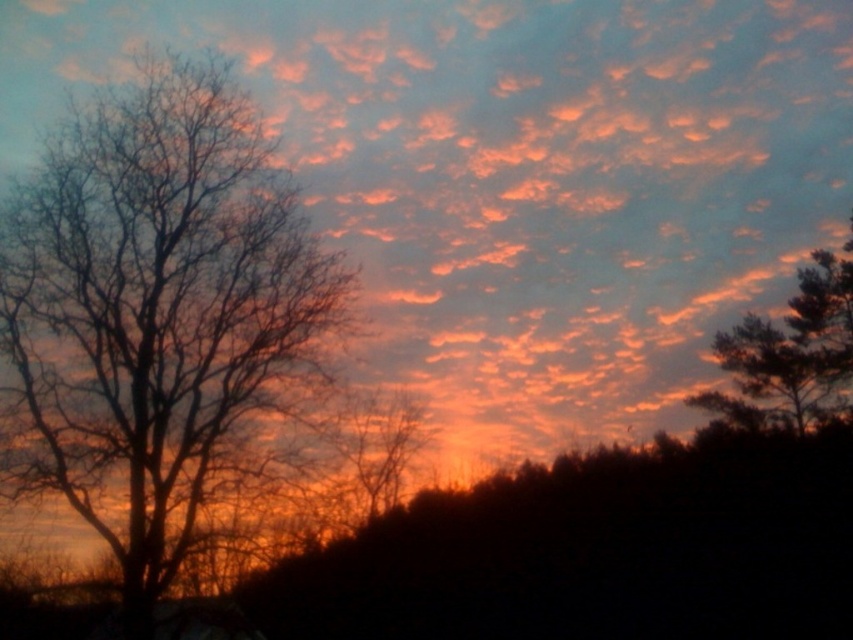
You are an astronomer observing the sunset scene. You notice a point at coordinates [790,349]. What object is located at that point?

The point at coordinates [790,349] indicates a silvery textured pine tree at upper right.

Looking at this image, you are an artist trying to paint this sunset scene. You want to ensure the silhouette bark tree at left and the silhouette bare tree at center are proportionally accurate. Which tree should you draw taller in your painting?

The silhouette bark tree at left should be drawn taller than the silhouette bare tree at center because the description states it is much taller.

Consider the image. You are an artist planning to paint this sunset scene. You want to ensure the silvery textured pine tree at upper right and the silhouette bare tree at center are proportionally accurate. Which tree should you paint as taller in your artwork?

The silhouette bare tree at center should be painted taller since the silvery textured pine tree at upper right is shorter than it according to the description.